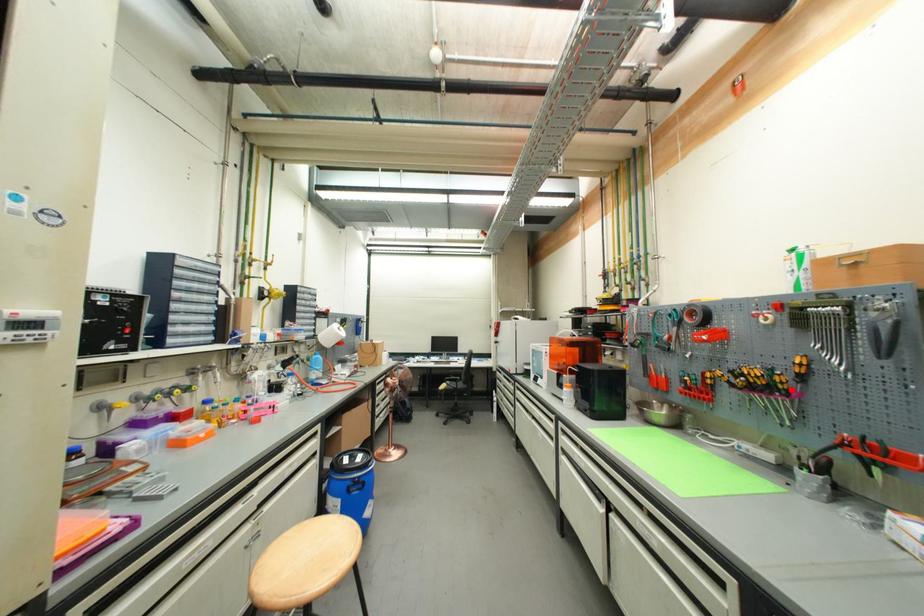
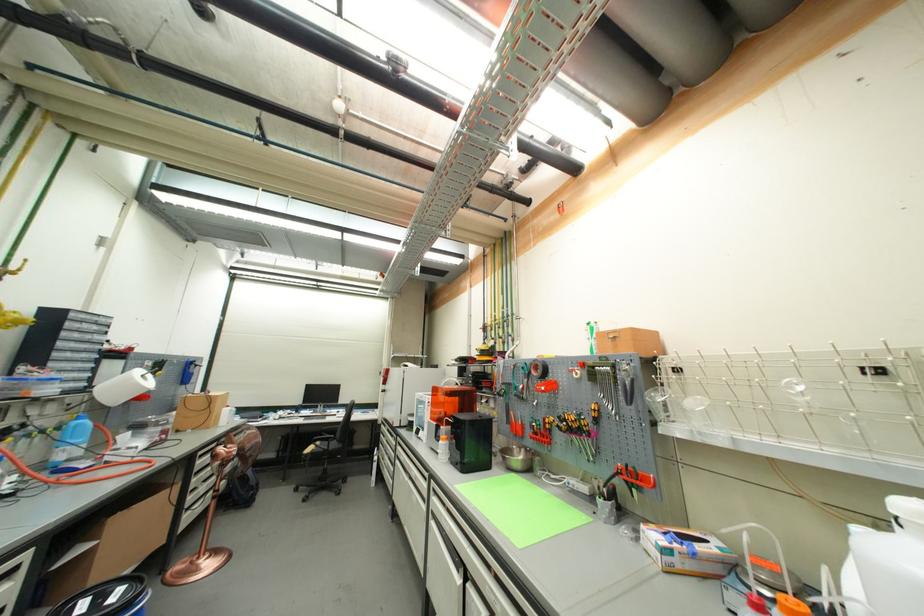
Find the pixel in the second image that matches the highlighted location in the first image.

(592, 431)